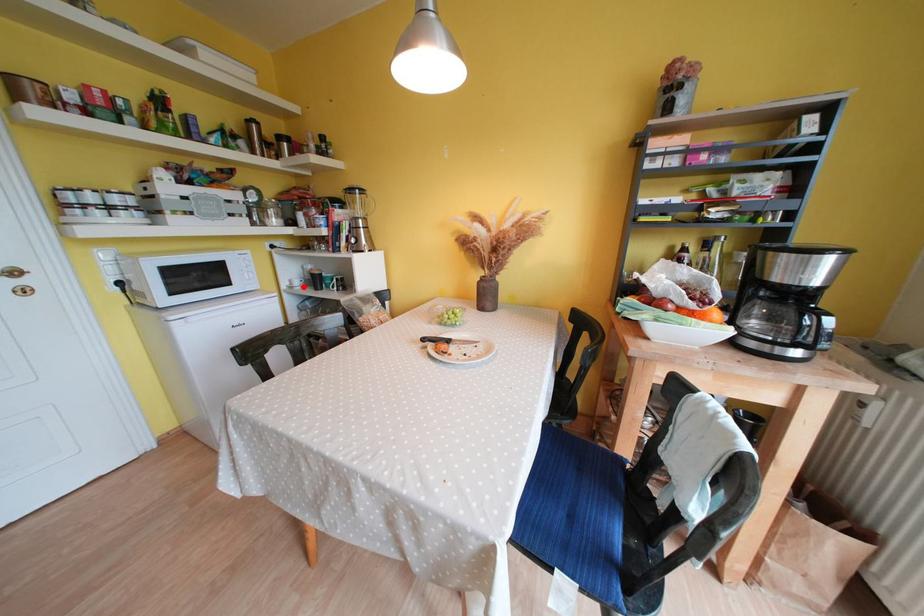
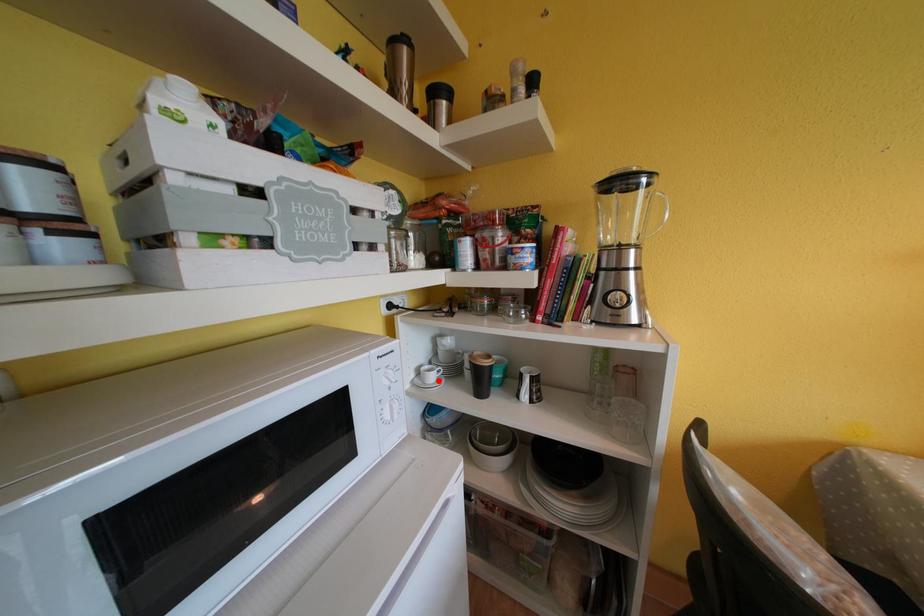
I am providing you with two images of the same scene from different viewpoints. A red point is marked on the first image and another point is marked on the second image. Is the red point in image1 aligned with the point shown in image2?

Yes